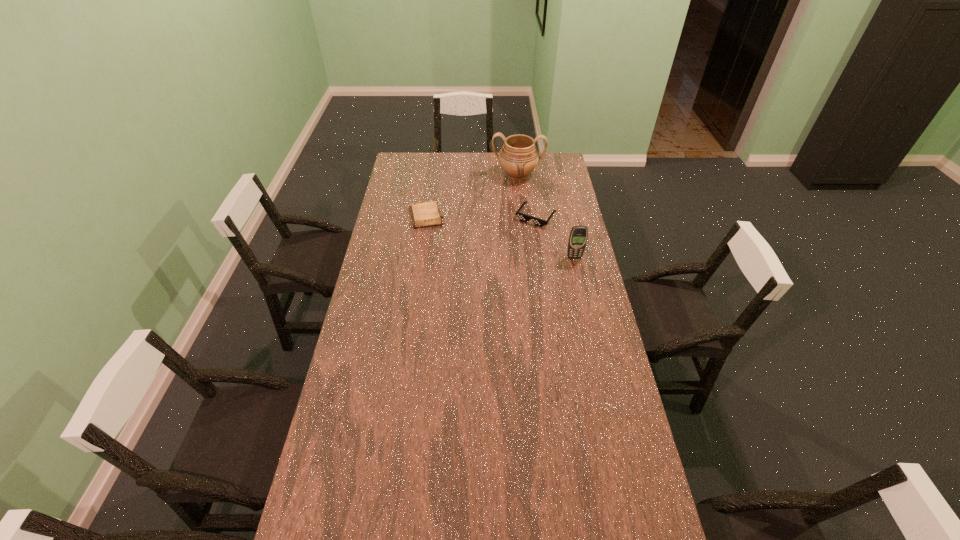
Find the location of a particular element. The image size is (960, 540). free spot between the sunglasses and the third shortest object is located at coordinates (555, 237).

Identify the location of vacant space that is in between the sunglasses and the third shortest object. click(x=555, y=237).

I want to click on free area in between the nearest object and the farthest object, so click(546, 216).

At what (x,y) coordinates should I click in order to perform the action: click on blank region between the leftmost object and the tallest object. Please return your answer as a coordinate pair (x, y). This screenshot has height=540, width=960. Looking at the image, I should click on (472, 195).

Locate an element on the screen. The height and width of the screenshot is (540, 960). vacant space that's between the tallest object and the diary is located at coordinates (472, 195).

The width and height of the screenshot is (960, 540). Find the location of `free space between the sunglasses and the tallest object`. free space between the sunglasses and the tallest object is located at coordinates (527, 196).

Find the location of a particular element. The height and width of the screenshot is (540, 960). free space between the sunglasses and the diary is located at coordinates (481, 217).

Find the location of a particular element. The width and height of the screenshot is (960, 540). object that ranks as the third closest to the sunglasses is located at coordinates (424, 214).

The width and height of the screenshot is (960, 540). What are the coordinates of `object that stands as the closest to the shortest object` in the screenshot? It's located at (518, 157).

Locate an element on the screen. The height and width of the screenshot is (540, 960). free space that satisfies the following two spatial constraints: 1. on the front side of the tallest object; 2. on the right side of the sunglasses is located at coordinates (522, 217).